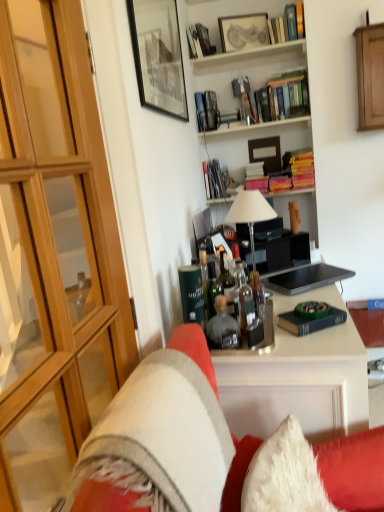
In order to click on vacant space to the right of hardcover book at upper center, marked as the 2th book in a top-to-bottom arrangement in this screenshot , I will do `click(223, 58)`.